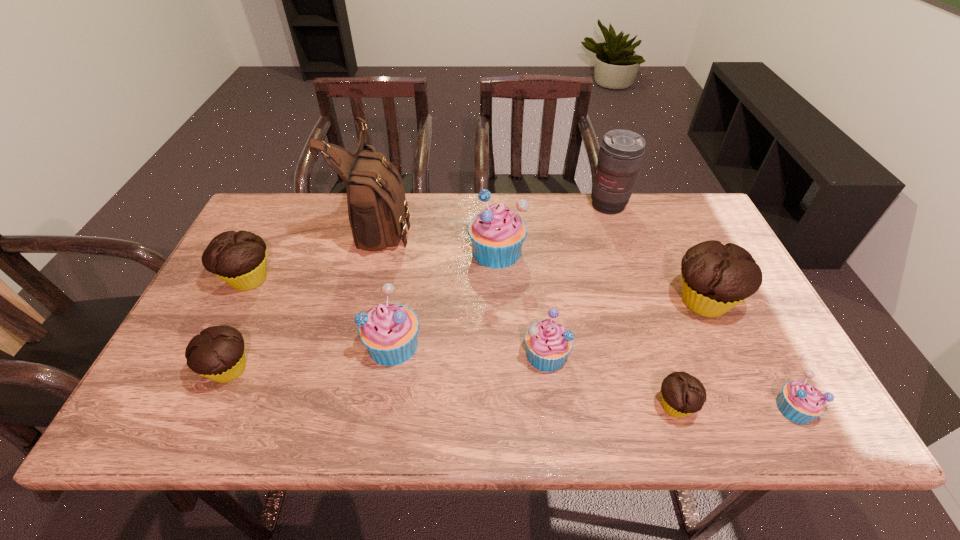
The image size is (960, 540). I want to click on vacant space situated on the left of the second smallest blue muffin, so click(x=442, y=354).

Where is `vacant space located 0.070m on the left of the third biggest chocolate muffin`? vacant space located 0.070m on the left of the third biggest chocolate muffin is located at coordinates (172, 369).

At what (x,y) coordinates should I click in order to perform the action: click on vacant region located 0.390m on the back of the rightmost blue muffin. Please return your answer as a coordinate pair (x, y). Looking at the image, I should click on (718, 266).

Locate an element on the screen. The image size is (960, 540). vacant area located 0.210m on the right of the smallest chocolate muffin is located at coordinates (794, 406).

At what (x,y) coordinates should I click in order to perform the action: click on shoulder bag at the far edge. Please return your answer as a coordinate pair (x, y). This screenshot has width=960, height=540. Looking at the image, I should click on (377, 208).

Locate an element on the screen. telephoto lens at the far edge is located at coordinates (621, 152).

What are the coordinates of `muffin located at the far edge` in the screenshot? It's located at (497, 234).

At what (x,y) coordinates should I click in order to perform the action: click on object that is at the near right corner. Please return your answer as a coordinate pair (x, y). This screenshot has width=960, height=540. Looking at the image, I should click on (800, 402).

The height and width of the screenshot is (540, 960). In the image, there is a desktop. Find the location of `vacant space at the far edge`. vacant space at the far edge is located at coordinates (550, 226).

Find the location of a particular element. blank area at the near edge is located at coordinates (297, 404).